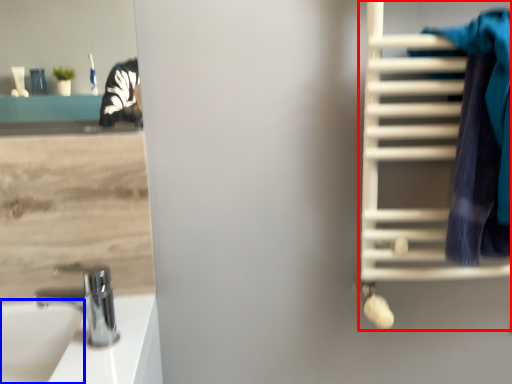
Question: Which object appears farthest to the camera in this image, bunk bed (highlighted by a red box) or sink (highlighted by a blue box)?

Choices:
 (A) bunk bed
 (B) sink

Answer: (A)